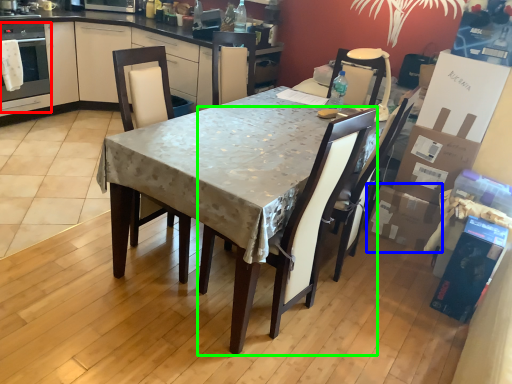
Question: Which object is the farthest from oven (highlighted by a red box)? Choose among these: cardboard box (highlighted by a blue box) or chair (highlighted by a green box).

Choices:
 (A) cardboard box
 (B) chair

Answer: (A)